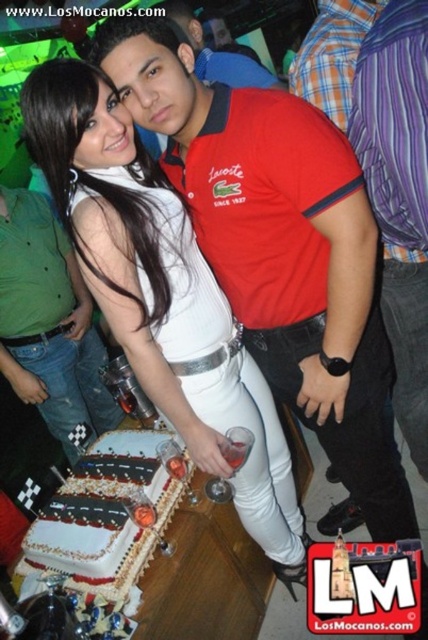
You are a photographer at the event and want to capture a clear photo of both the white satin dress at center and the matte red polo shirt at center. Which one will appear larger in the photo?

The white satin dress at center will appear larger in the photo because it is closer to the viewer than the matte red polo shirt at center.

You are a photographer at a party and need to capture a photo of both the green denim jeans at center and the white fondant cake at center in the same frame. Your camera has a maximum focus range of 1 meter. Can you fit both subjects into the shot without moving the camera?

The green denim jeans at center and white fondant cake at center are 96.98 centimeters apart, which is less than 1 meter. Therefore, you can fit both subjects into the shot without moving the camera.

In the scene shown: You are at a party and want to take a photo of the white fondant cake at center without including the green denim jeans at center in the frame. How should you position yourself relative to the cake?

Move behind the white fondant cake at center so that it is between you and the green denim jeans at center, as the cake is behind the jeans. This way, the jeans will be blocked from view by the cake.